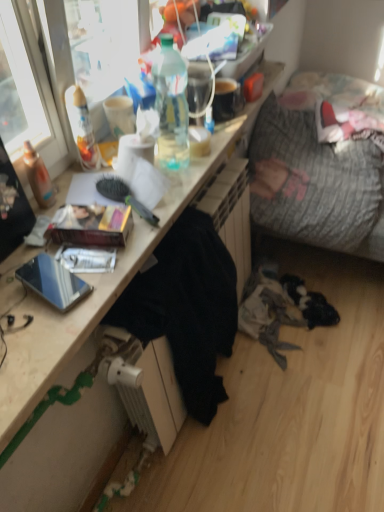
Find the location of a particular element. This screenshot has width=384, height=512. vacant space to the left of matte cardboard book at center is located at coordinates (29, 249).